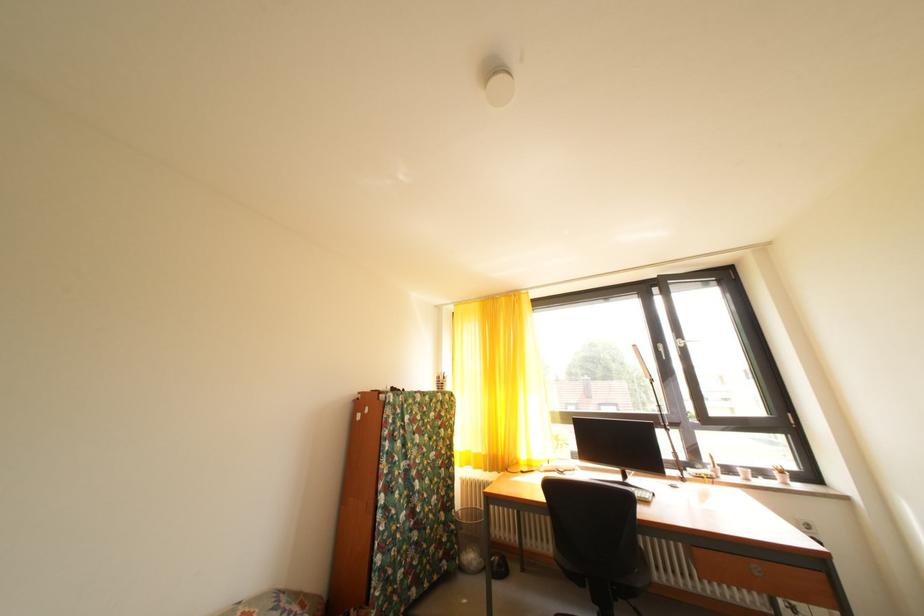
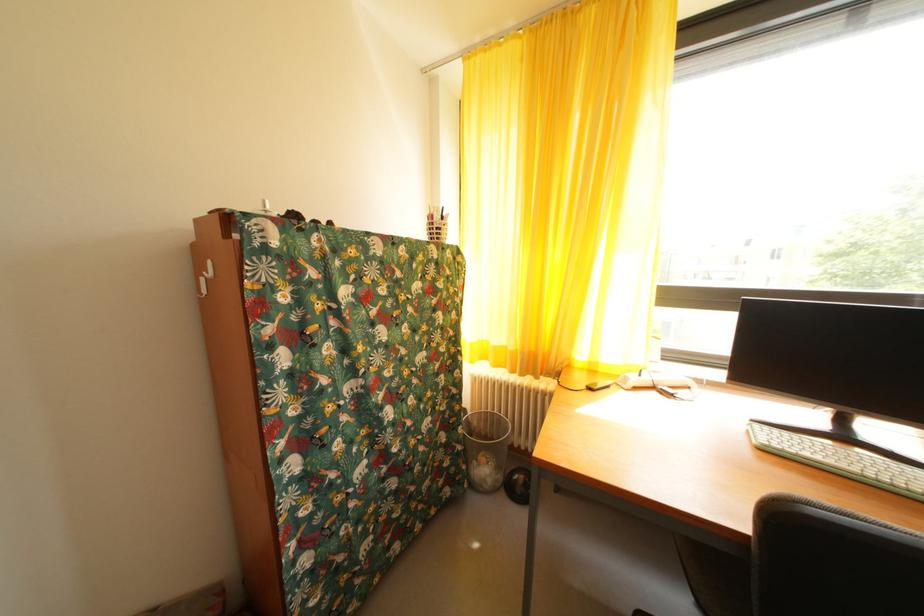
The point at (447, 384) is marked in the first image. Where is the corresponding point in the second image?

(440, 223)